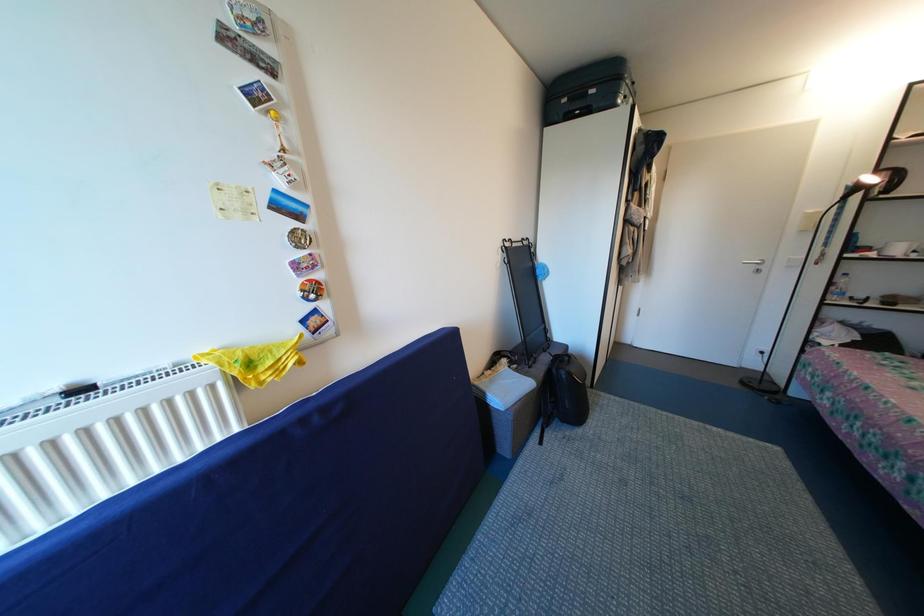
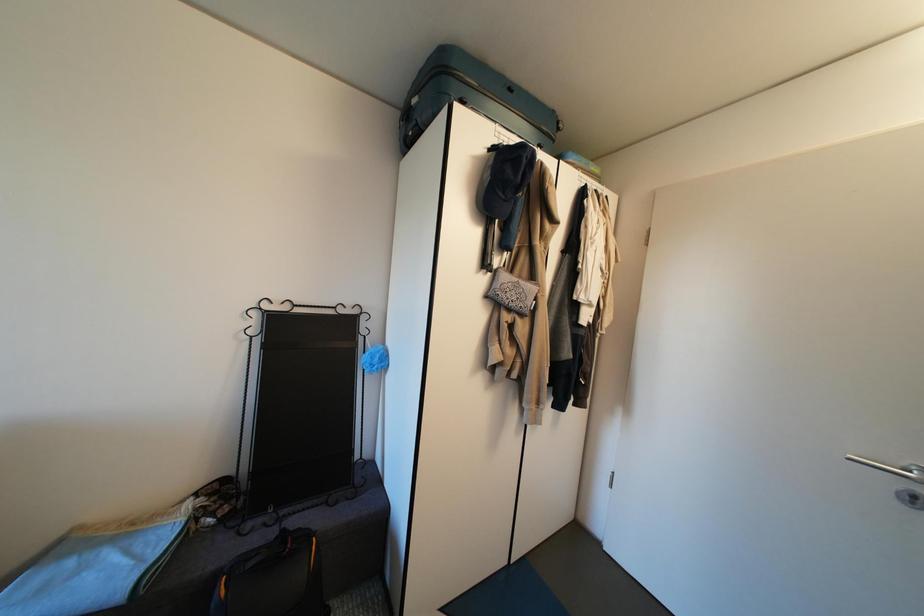
What movement of the cameraman would produce the second image?

The cameraman moved toward right, forward.